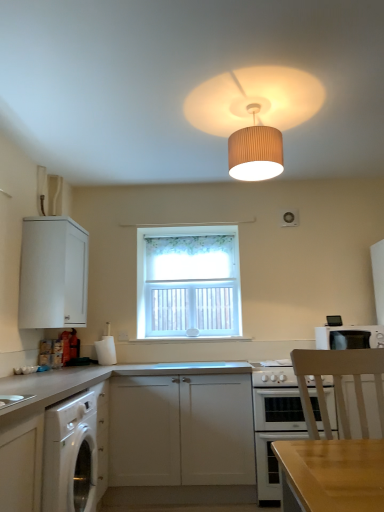
Find the location of a particular element. empty space that is ontop of white glossy exhaust hood at upper center (from a real-world perspective) is located at coordinates (185, 215).